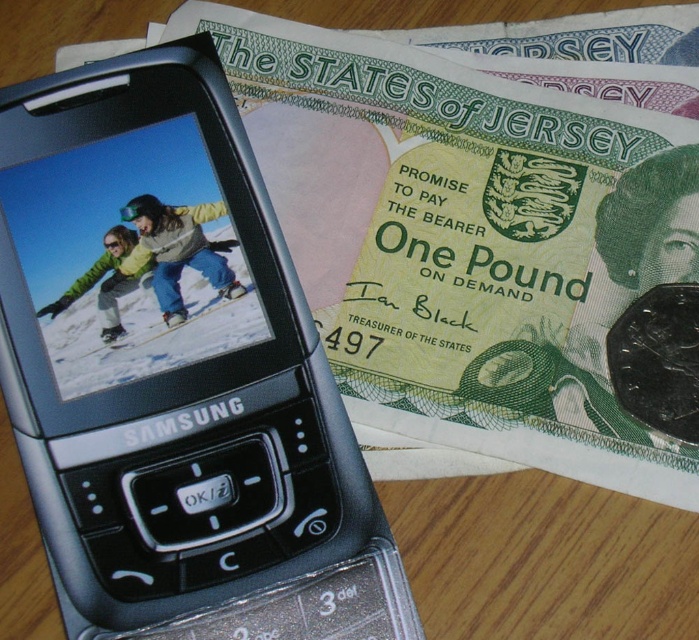
Based on the photo, you are a photographer trying to capture a clear shot of both the black plastic samsung phone at upper left and the matte yellow snowboarder at center. Given their sizes in the image, which object would require you to adjust your camera focus to a closer range to ensure clarity?

The matte yellow snowboarder at center would require adjusting the camera focus to a closer range because the black plastic samsung phone at upper left is much taller, meaning the snowboarder is smaller and thus needs a closer focus for clarity.

You are trying to place both the black plastic samsung phone at upper left and the matte yellow snowboarder at center into a rectangular box. The box can only fit items that are narrower than 10 cm. Based on their widths, can both items fit into the box?

The black plastic samsung phone at upper left might be wider than matte yellow snowboarder at center, but since the exact width of the phone isn